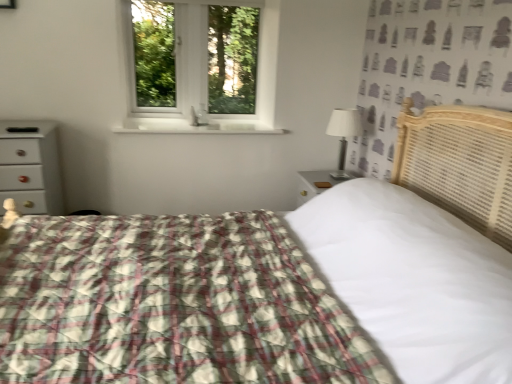
Question: Does white glossy chest of drawers at left contain white plastic window at upper center?

Choices:
 (A) yes
 (B) no

Answer: (B)

Question: From a real-world perspective, is white glossy chest of drawers at left beneath white plastic window at upper center?

Choices:
 (A) yes
 (B) no

Answer: (A)

Question: Is white glossy chest of drawers at left to the right of white plastic window at upper center from the viewer's perspective?

Choices:
 (A) yes
 (B) no

Answer: (B)

Question: From a real-world perspective, is white glossy chest of drawers at left on top of white plastic window at upper center?

Choices:
 (A) yes
 (B) no

Answer: (B)

Question: Is white glossy chest of drawers at left in front of white plastic window at upper center?

Choices:
 (A) yes
 (B) no

Answer: (A)

Question: Is white glossy chest of drawers at left with white plastic window at upper center?

Choices:
 (A) no
 (B) yes

Answer: (A)

Question: Can you confirm if white glossy window sill at center is wider than white glossy chest of drawers at left?

Choices:
 (A) yes
 (B) no

Answer: (A)

Question: Is white glossy window sill at center touching white glossy chest of drawers at left?

Choices:
 (A) no
 (B) yes

Answer: (A)

Question: Is white glossy window sill at center outside of white glossy chest of drawers at left?

Choices:
 (A) yes
 (B) no

Answer: (A)

Question: Is white glossy window sill at center positioned before white glossy chest of drawers at left?

Choices:
 (A) yes
 (B) no

Answer: (B)

Question: From the image's perspective, is white glossy window sill at center over white glossy chest of drawers at left?

Choices:
 (A) no
 (B) yes

Answer: (B)

Question: Does white glossy window sill at center turn towards white glossy chest of drawers at left?

Choices:
 (A) no
 (B) yes

Answer: (A)

Question: From a real-world perspective, is white fabric-covered lamp at right beneath plaid fabric bed at center?

Choices:
 (A) no
 (B) yes

Answer: (A)